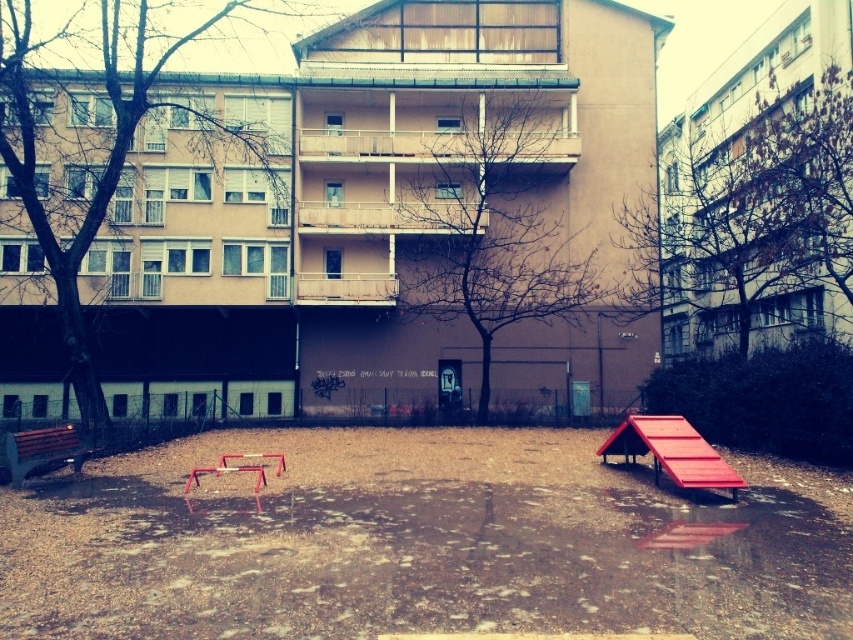
Can you confirm if smooth wooden ramp at lower right is shorter than metallic silver bench at center?

Incorrect, smooth wooden ramp at lower right's height does not fall short of metallic silver bench at center's.

Is smooth wooden ramp at lower right below metallic silver bench at center?

No, smooth wooden ramp at lower right is not below metallic silver bench at center.

This screenshot has height=640, width=853. In order to click on smooth wooden ramp at lower right in this screenshot , I will do `click(672, 451)`.

Can you confirm if smooth wooden ramp at lower right is taller than metallic red bench at lower center?

Correct, smooth wooden ramp at lower right is much taller as metallic red bench at lower center.

Is smooth wooden ramp at lower right in front of metallic red bench at lower center?

Yes, it is in front of metallic red bench at lower center.

Between point (704, 476) and point (216, 467), which one is positioned in front?

Point (704, 476) is more forward.

The image size is (853, 640). Identify the location of smooth wooden ramp at lower right. (672, 451).

Is brown wooden bench at lower left in front of metallic red bench at lower center?

That is False.

This screenshot has width=853, height=640. Describe the element at coordinates (41, 451) in the screenshot. I see `brown wooden bench at lower left` at that location.

Between point (25, 458) and point (198, 467), which one is positioned in front?

Positioned in front is point (25, 458).

Identify the location of brown wooden bench at lower left. (41, 451).